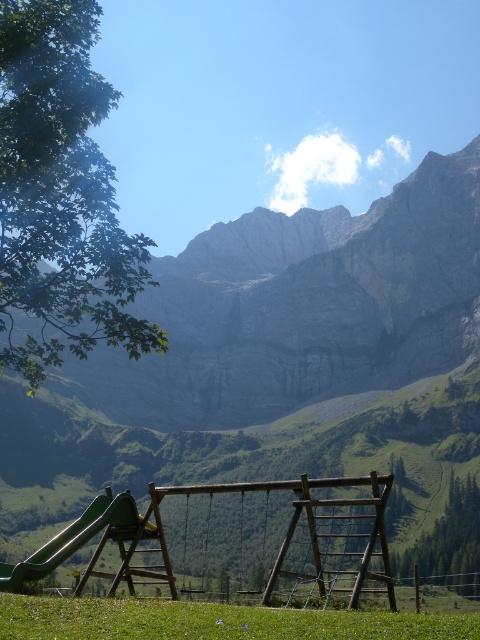
Question: Estimate the real-world distances between objects in this image. Which object is farther from the green plastic slide at lower left?

Choices:
 (A) green grassy field at lower center
 (B) gray rock mountain at upper center

Answer: (B)

Question: Is green grassy field at lower center thinner than green plastic slide at lower left?

Choices:
 (A) yes
 (B) no

Answer: (B)

Question: Considering the relative positions of gray rock mountain at upper center and green grassy field at lower center in the image provided, where is gray rock mountain at upper center located with respect to green grassy field at lower center?

Choices:
 (A) left
 (B) right

Answer: (B)

Question: Does gray rock mountain at upper center appear on the left side of green grassy field at lower center?

Choices:
 (A) no
 (B) yes

Answer: (A)

Question: Which object is positioned farthest from the green grassy field at lower center?

Choices:
 (A) green plastic slide at lower left
 (B) gray rock mountain at upper center

Answer: (B)

Question: Which is farther from the green plastic slide at lower left?

Choices:
 (A) green grassy field at lower center
 (B) gray rock mountain at upper center

Answer: (B)